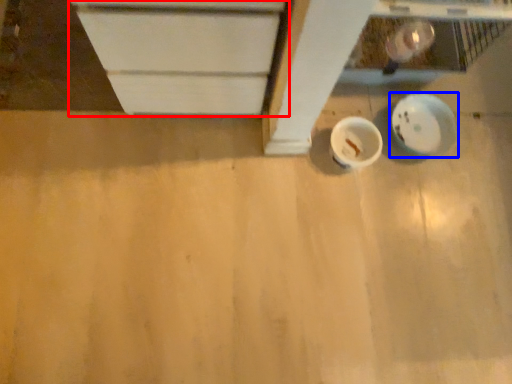
Question: Among these objects, which one is nearest to the camera, cabinetry (highlighted by a red box) or plate (highlighted by a blue box)?

Choices:
 (A) cabinetry
 (B) plate

Answer: (A)